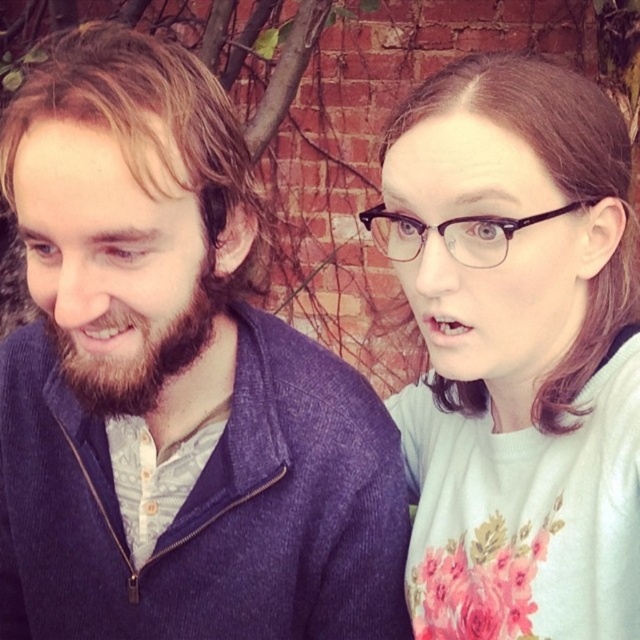
Does matte blue sweater at left appear on the right side of brown smooth hair at upper right?

No, matte blue sweater at left is not to the right of brown smooth hair at upper right.

Consider the image. Who is positioned more to the right, matte blue sweater at left or brown smooth hair at upper right?

Positioned to the right is brown smooth hair at upper right.

Locate an element on the screen. matte blue sweater at left is located at coordinates (172, 381).

Is dark brown fuzzy beard at left in front of black plastic glasses at upper right?

No, it is not.

Which is in front, point (97, 403) or point (458, 221)?

Point (458, 221)

Does point (134, 323) lie behind point (416, 243)?

No, it is not.

Where is `dark brown fuzzy beard at left`? dark brown fuzzy beard at left is located at coordinates (138, 353).

Which is above, matte blue sweater at left or black plastic glasses at upper right?

Positioned higher is black plastic glasses at upper right.

Is point (134, 348) more distant than point (412, 218)?

Yes.

Where is `matte blue sweater at left`? Image resolution: width=640 pixels, height=640 pixels. matte blue sweater at left is located at coordinates (172, 381).

Locate an element on the screen. Image resolution: width=640 pixels, height=640 pixels. matte blue sweater at left is located at coordinates (172, 381).